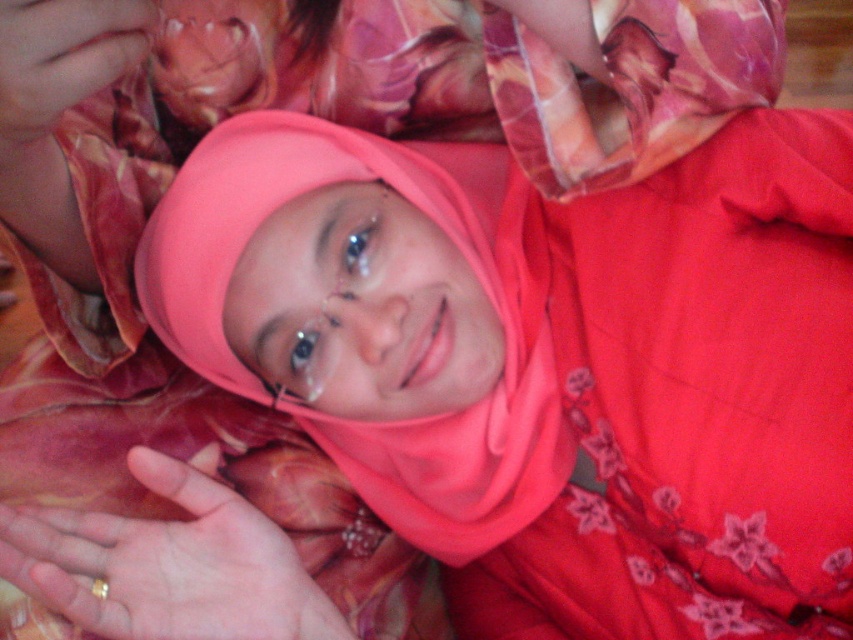
Question: Which object appears closest to the camera in this image?

Choices:
 (A) pink fabric at upper left
 (B) gold metallic ring at lower left

Answer: (A)

Question: Considering the relative positions of gold metallic ring at lower left and pink fabric at upper left in the image provided, where is gold metallic ring at lower left located with respect to pink fabric at upper left?

Choices:
 (A) left
 (B) right

Answer: (B)

Question: Can you confirm if matte pink hijab at center is bigger than pink fabric at upper left?

Choices:
 (A) yes
 (B) no

Answer: (A)

Question: Does matte pink hijab at center appear on the right side of pink fabric at upper left?

Choices:
 (A) no
 (B) yes

Answer: (B)

Question: Which object appears closest to the camera in this image?

Choices:
 (A) matte pink hijab at center
 (B) pink fabric at upper left
 (C) pink floral scarf at upper center

Answer: (B)

Question: Which object appears closest to the camera in this image?

Choices:
 (A) matte pink hijab at center
 (B) gold metallic ring at lower left
 (C) pink floral scarf at upper center
 (D) pink fabric at upper left

Answer: (D)